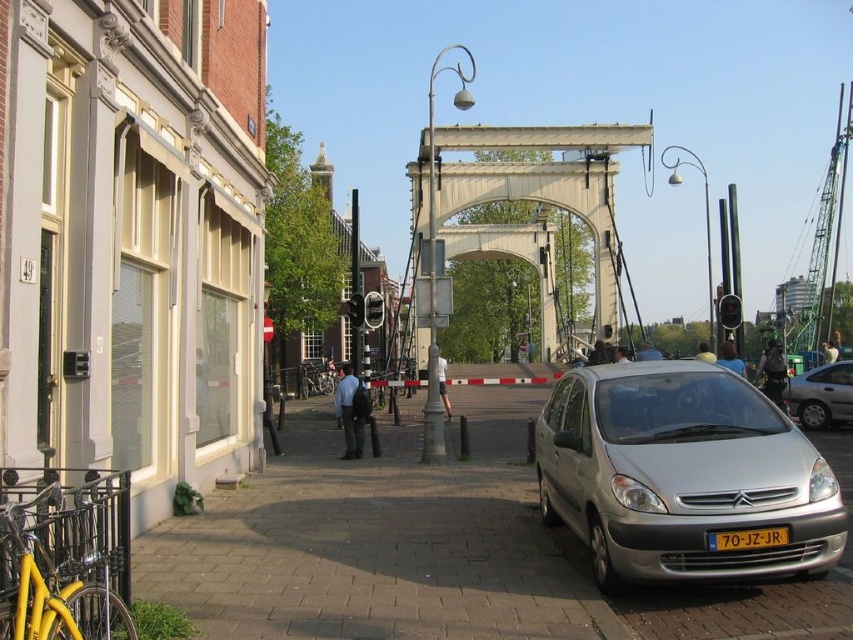
In the scene shown: You are a delivery drone flying over the urban street scene. Your GPS shows that you need to deliver a package to the yellow plastic license plate at center. According to the coordinates in the scene description, what are the exact coordinates where you should drop the package?

The exact coordinates for the yellow plastic license plate at center are at point (747, 538).